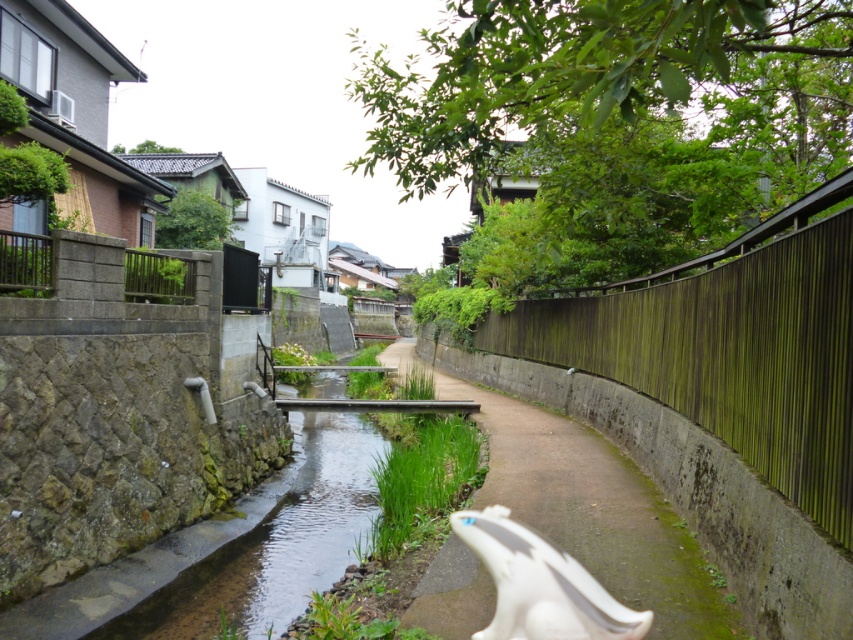
Is brown concrete path at center further to the viewer compared to white glossy statue at center?

That is True.

Does point (531, 467) lie behind point (631, 625)?

That is True.

You are a GUI agent. You are given a task and a screenshot of the screen. Output one action in this format:
    pyautogui.click(x=<x>, y=<y>)
    Task: Click on the brown concrete path at center
    
    Given the screenshot: What is the action you would take?
    pyautogui.click(x=595, y=512)

Locate an element on the screen. The width and height of the screenshot is (853, 640). brown concrete path at center is located at coordinates (595, 512).

Which is above, brown concrete path at center or clear water at center?

Positioned higher is brown concrete path at center.

This screenshot has height=640, width=853. What do you see at coordinates (595, 512) in the screenshot?
I see `brown concrete path at center` at bounding box center [595, 512].

The image size is (853, 640). I want to click on brown concrete path at center, so (x=595, y=512).

Does clear water at center appear on the right side of white glossy statue at center?

Incorrect, clear water at center is not on the right side of white glossy statue at center.

Which is more to the left, clear water at center or white glossy statue at center?

clear water at center is more to the left.

The height and width of the screenshot is (640, 853). I want to click on clear water at center, so click(274, 545).

At what (x,y) coordinates should I click in order to perform the action: click on clear water at center. Please return your answer as a coordinate pair (x, y). Image resolution: width=853 pixels, height=640 pixels. Looking at the image, I should click on (274, 545).